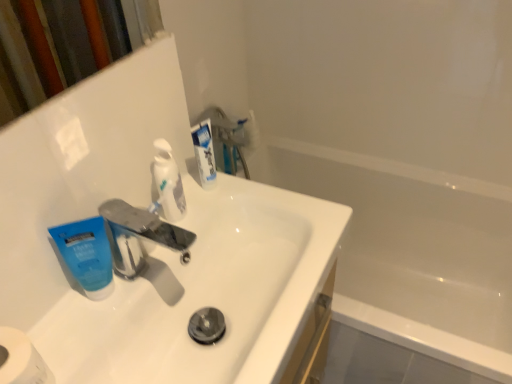
Question: Is white glossy bathtub at center bigger or smaller than white glossy toothpaste at upper center, which ranks as the 3th toothpaste in left-to-right order?

Choices:
 (A) small
 (B) big

Answer: (B)

Question: From the image's perspective, is white glossy bathtub at center located above or below white glossy toothpaste at upper center, placed as the 1th toothpaste when sorted from right to left?

Choices:
 (A) below
 (B) above

Answer: (A)

Question: Estimate the real-world distances between objects in this image. Which object is closer to the white glossy sink at center?

Choices:
 (A) white glossy toothpaste at center, which ranks as the second toothpaste in left-to-right order
 (B) white glossy bathtub at center
 (C) white matte toilet paper at lower left
 (D) white glossy toothpaste at upper center, which ranks as the 3th toothpaste in left-to-right order
 (E) metallic silver faucet at center

Answer: (E)

Question: Which of these objects is positioned farthest from the metallic silver faucet at center?

Choices:
 (A) white glossy bathtub at center
 (B) white glossy toothpaste at upper center, which ranks as the 3th toothpaste in left-to-right order
 (C) white matte toilet paper at lower left
 (D) blue matte toothpaste at left, which ranks as the 1th toothpaste in left-to-right order
 (E) white glossy sink at center

Answer: (A)